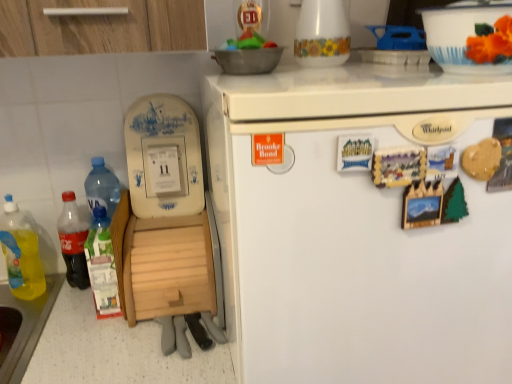
Identify the location of empty space that is ontop of wooden at left (from a real-world perspective). The image size is (512, 384). coord(159,221).